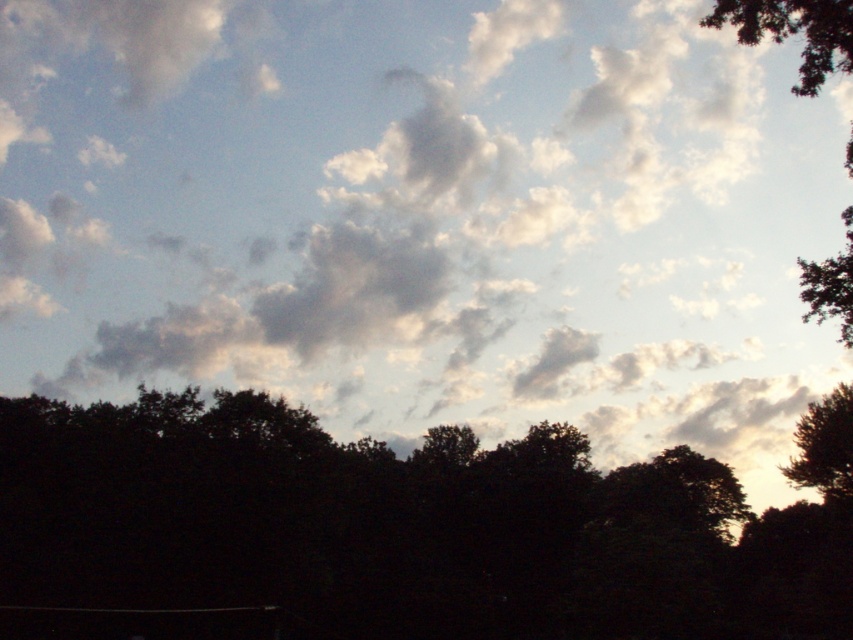
Can you confirm if white fluffy cloud at upper center is shorter than silhouette leafy tree at right?

In fact, white fluffy cloud at upper center may be taller than silhouette leafy tree at right.

Between white fluffy cloud at upper center and silhouette leafy tree at right, which one is positioned lower?

silhouette leafy tree at right

The height and width of the screenshot is (640, 853). Find the location of `white fluffy cloud at upper center`. white fluffy cloud at upper center is located at coordinates (421, 214).

Locate an element on the screen. Image resolution: width=853 pixels, height=640 pixels. white fluffy cloud at upper center is located at coordinates (421, 214).

Can you confirm if green leafy tree at upper right is positioned to the right of silhouette leafy tree at right?

Correct, you'll find green leafy tree at upper right to the right of silhouette leafy tree at right.

Who is more distant from viewer, (822,32) or (851,417)?

The point (851,417) is more distant.

I want to click on green leafy tree at upper right, so click(x=793, y=32).

Find the location of a particular element. dark green leafy tree at center is located at coordinates (398, 529).

Based on the photo, can you confirm if dark green leafy tree at center is positioned to the left of silhouette leafy tree at right?

Yes, dark green leafy tree at center is to the left of silhouette leafy tree at right.

Does point (611, 612) lie in front of point (842, 403)?

Yes, it is.

Find the location of `dark green leafy tree at center`. dark green leafy tree at center is located at coordinates (398, 529).